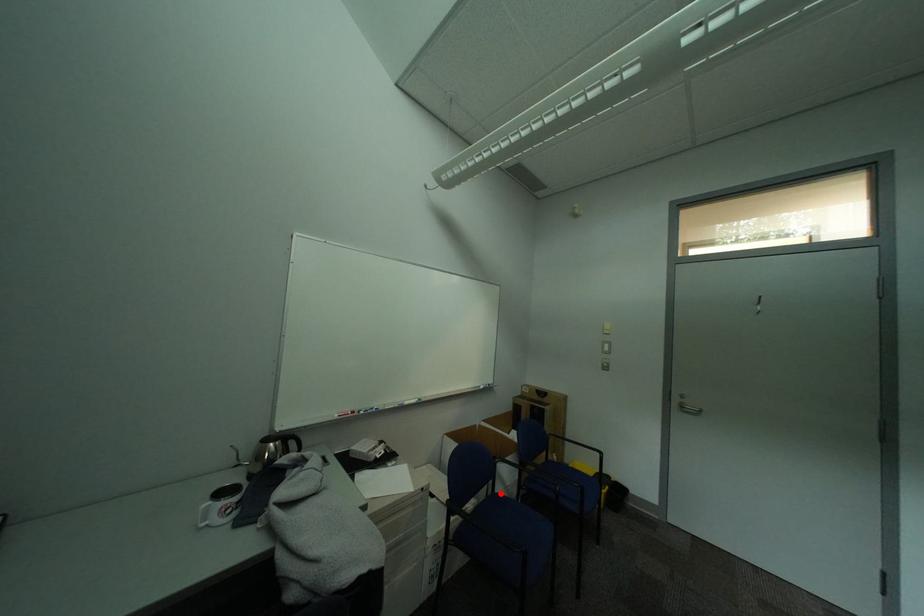
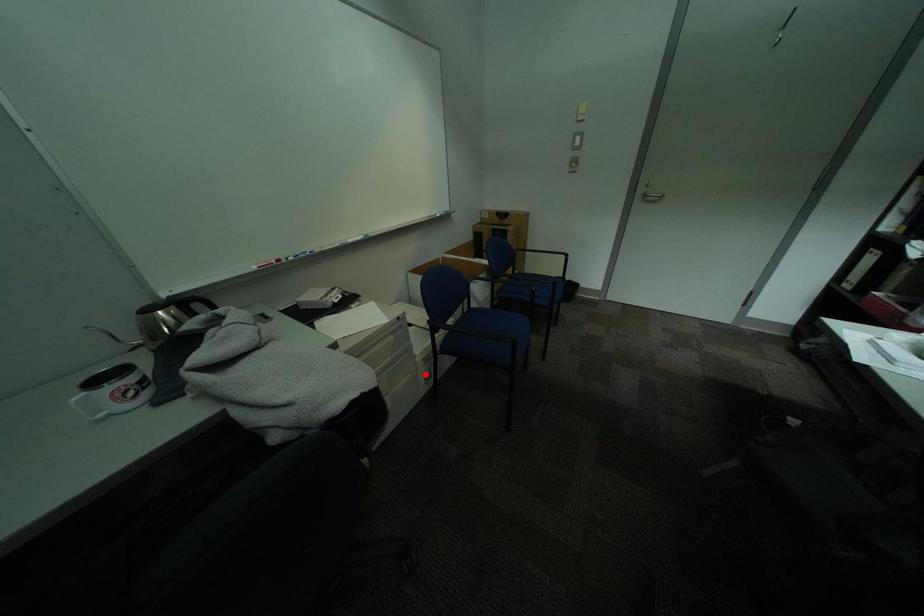
I am providing you with two images of the same scene from different viewpoints. A red point is marked on the first image and another point is marked on the second image. Do the highlighted points in image1 and image2 indicate the same real-world spot?

No